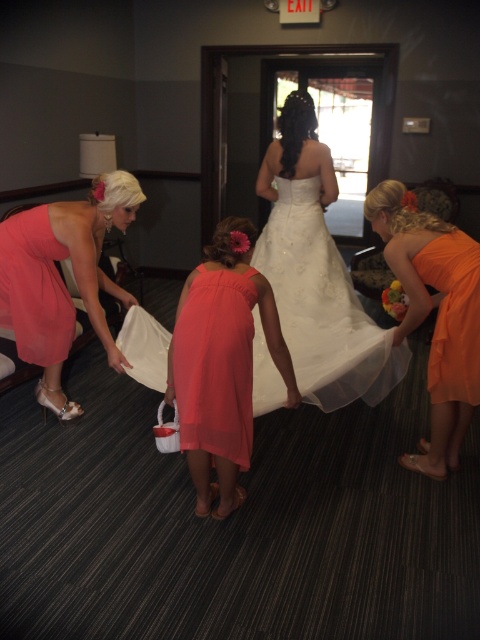
Is pink chiffon dress at center to the left of orange satin dress at right from the viewer's perspective?

Indeed, pink chiffon dress at center is positioned on the left side of orange satin dress at right.

Can you confirm if pink chiffon dress at center is positioned below orange satin dress at right?

Correct, pink chiffon dress at center is located below orange satin dress at right.

Describe the element at coordinates (222, 362) in the screenshot. I see `pink chiffon dress at center` at that location.

The width and height of the screenshot is (480, 640). Identify the location of pink chiffon dress at center. (222, 362).

Does white satin dress at center appear on the right side of pink chiffon dress at center?

Indeed, white satin dress at center is positioned on the right side of pink chiffon dress at center.

Is white satin dress at center wider than pink chiffon dress at center?

Yes, white satin dress at center is wider than pink chiffon dress at center.

Between point (268, 410) and point (193, 358), which one is positioned in front?

Point (193, 358) is in front.

The height and width of the screenshot is (640, 480). I want to click on white satin dress at center, so click(x=316, y=273).

Can you confirm if coral satin dress at left is wider than matte pink dress at left?

Correct, the width of coral satin dress at left exceeds that of matte pink dress at left.

Between coral satin dress at left and matte pink dress at left, which one appears on the left side from the viewer's perspective?

matte pink dress at left

Where is `coral satin dress at left`? The height and width of the screenshot is (640, 480). coral satin dress at left is located at coordinates (60, 278).